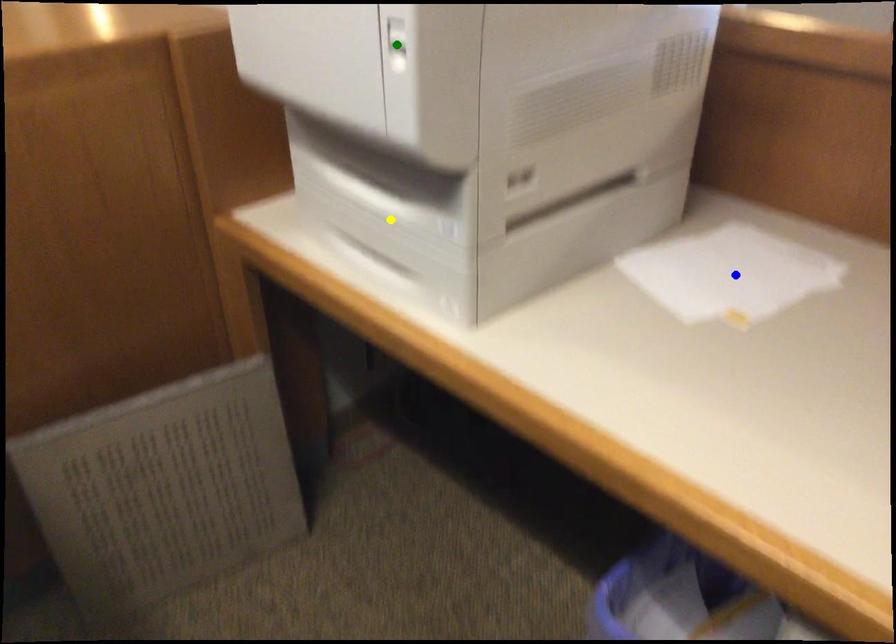
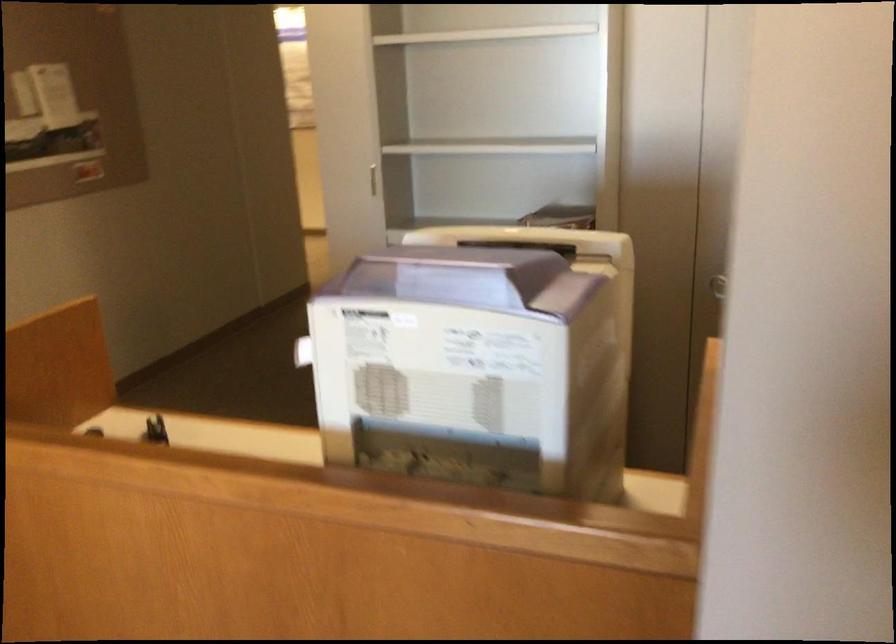
I am providing you with two images of the same scene from different viewpoints. Three points are marked in image1. Which point corresponds to a part or object that is occluded in image2?In image1, three points are marked. Which of them correspond to a part or object that is occluded in image2?Among the three points shown in image1, which one corresponds to a part or object that is no longer visible due to occlusion in image2?

Invisible in image2: blue point, green point, yellow point.